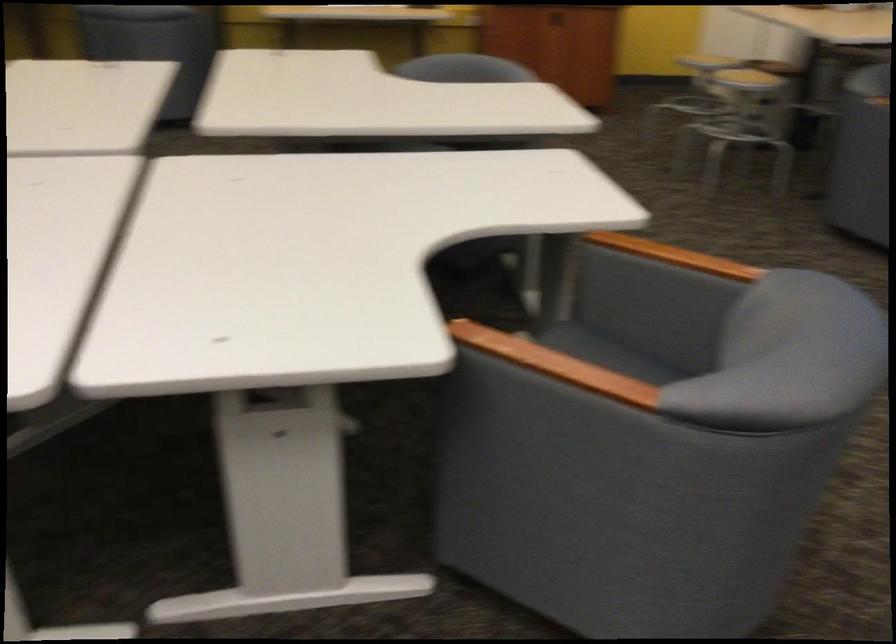
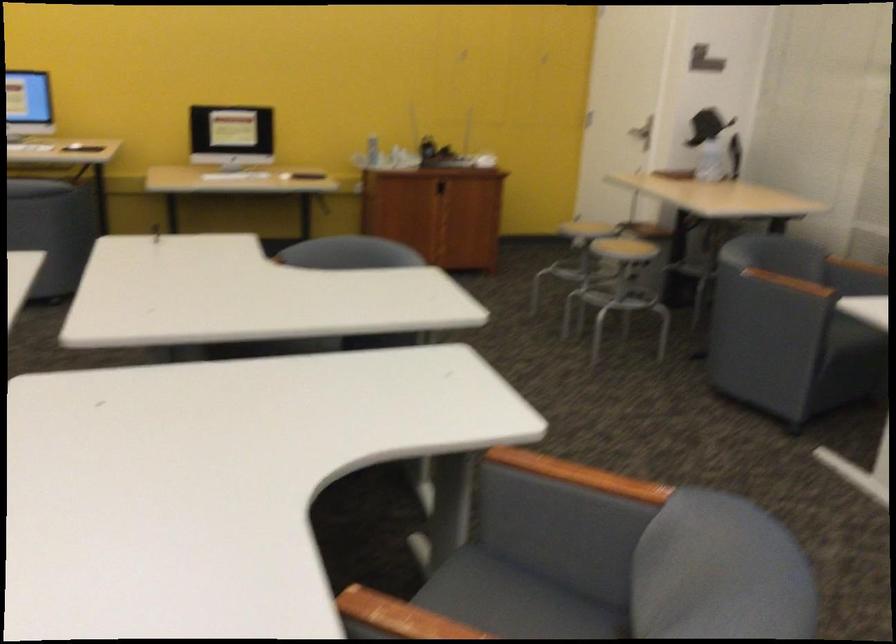
Question: In a continuous first-person perspective shot, in which direction is the camera moving?

Choices:
 (A) Left
 (B) Right
 (C) Forward
 (D) Backward

Answer: (C)